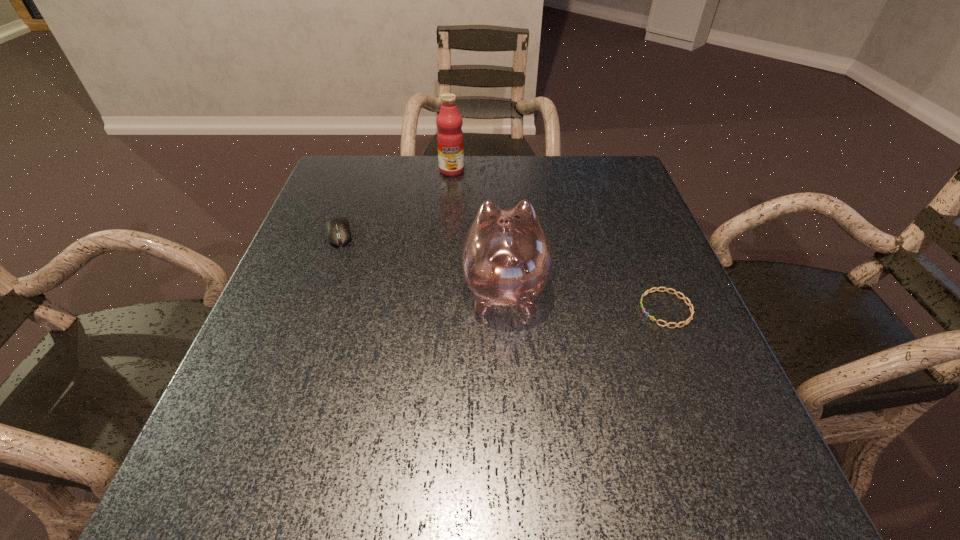
The image size is (960, 540). Find the location of `free spot located on the front facing side of the second tallest object`. free spot located on the front facing side of the second tallest object is located at coordinates (498, 171).

Identify the location of free space located 0.320m on the front facing side of the second tallest object. (498, 179).

Locate an element on the screen. vacant space located 0.160m on the back of the third nearest object is located at coordinates (357, 185).

This screenshot has width=960, height=540. Identify the location of vacant space located 0.390m on the surface of the bracelet showing star-shaped elements. (442, 309).

The height and width of the screenshot is (540, 960). I want to click on vacant space located on the surface of the bracelet showing star-shaped elements, so click(610, 309).

The width and height of the screenshot is (960, 540). What are the coordinates of `blank space located 0.060m on the surface of the bracelet showing star-shaped elements` in the screenshot? It's located at [610, 309].

In order to click on object at the far edge in this screenshot , I will do `click(450, 141)`.

Identify the location of object situated at the left edge. Image resolution: width=960 pixels, height=540 pixels. (338, 232).

Image resolution: width=960 pixels, height=540 pixels. Find the location of `object located at the right edge`. object located at the right edge is located at coordinates (689, 304).

This screenshot has width=960, height=540. Identify the location of vacant point at the far edge. (518, 194).